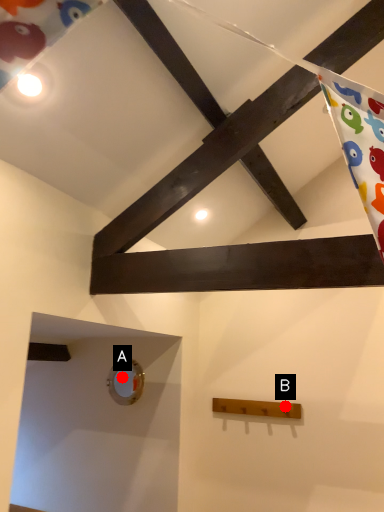
Question: Two points are circled on the image, labeled by A and B beside each circle. Which of the following is the closest to the observer?

Choices:
 (A) A is closer
 (B) B is closer

Answer: (B)